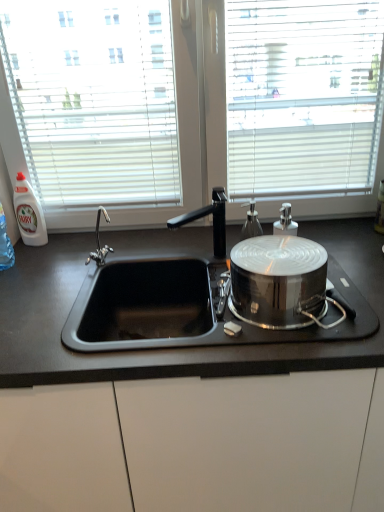
Identify the location of vacant space to the right of white plastic bottle at left, marked as the 2th bottle in a right-to-left arrangement. Image resolution: width=384 pixels, height=512 pixels. (74, 245).